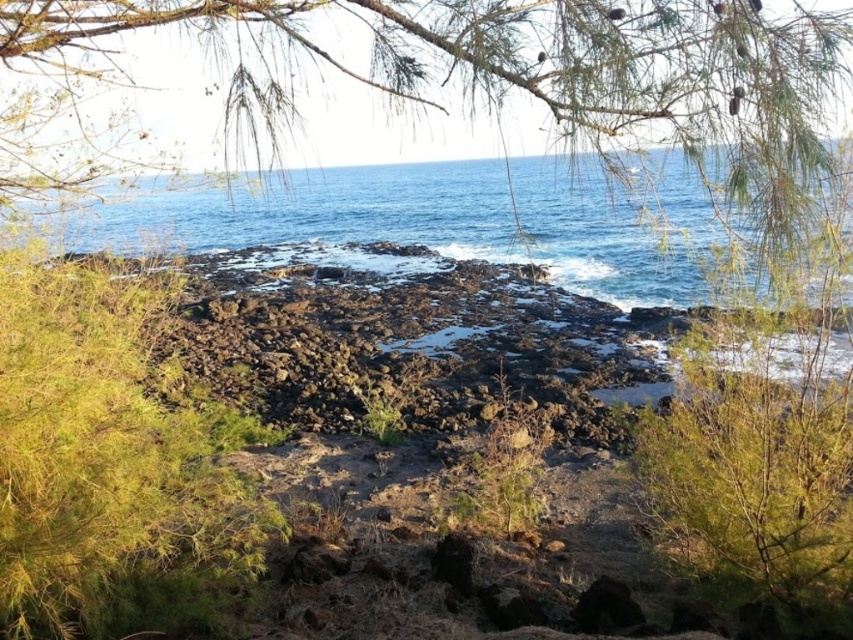
Does point (625, 209) come behind point (778, 577)?

Yes, point (625, 209) is farther from viewer.

Consider the image. Is blue water at center below green leafy tree at upper right?

Actually, blue water at center is above green leafy tree at upper right.

Who is more forward, (244,246) or (796,477)?

Positioned in front is point (796,477).

Find the location of `blue water at center`. blue water at center is located at coordinates (440, 220).